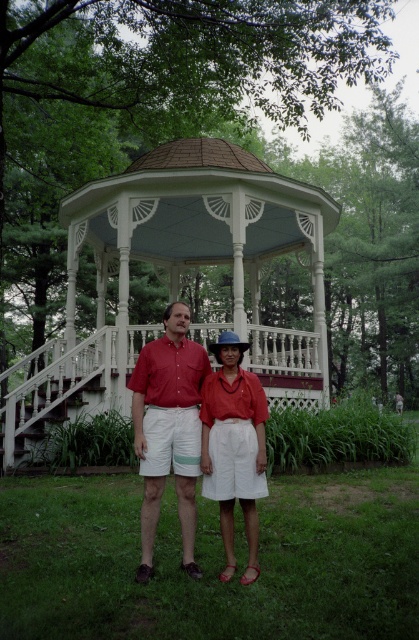
Does white painted wood porch at center appear on the right side of matte red shirt at center?

Correct, you'll find white painted wood porch at center to the right of matte red shirt at center.

Is point (85, 342) positioned before point (183, 400)?

No, (85, 342) is further to viewer.

This screenshot has height=640, width=419. What do you see at coordinates (69, 380) in the screenshot?
I see `white painted wood porch at center` at bounding box center [69, 380].

At what (x,y) coordinates should I click in order to perform the action: click on white painted wood porch at center. Please return your answer as a coordinate pair (x, y). The width and height of the screenshot is (419, 640). Looking at the image, I should click on (69, 380).

Between point (74, 348) and point (246, 579), which one is positioned in front?

Positioned in front is point (246, 579).

Is white painted wood porch at center positioned behind matte red blouse at center?

Yes, it is behind matte red blouse at center.

Between point (313, 364) and point (261, 410), which one is positioned behind?

The point (313, 364) is behind.

Where is `white painted wood porch at center`? white painted wood porch at center is located at coordinates (69, 380).

What do you see at coordinates (168, 429) in the screenshot?
I see `matte red shirt at center` at bounding box center [168, 429].

Does matte red shirt at center appear over matte red blouse at center?

No.

Between point (167, 307) and point (232, 429), which one is positioned in front?

Point (232, 429)

The height and width of the screenshot is (640, 419). What are the coordinates of `matte red shirt at center` in the screenshot? It's located at (168, 429).